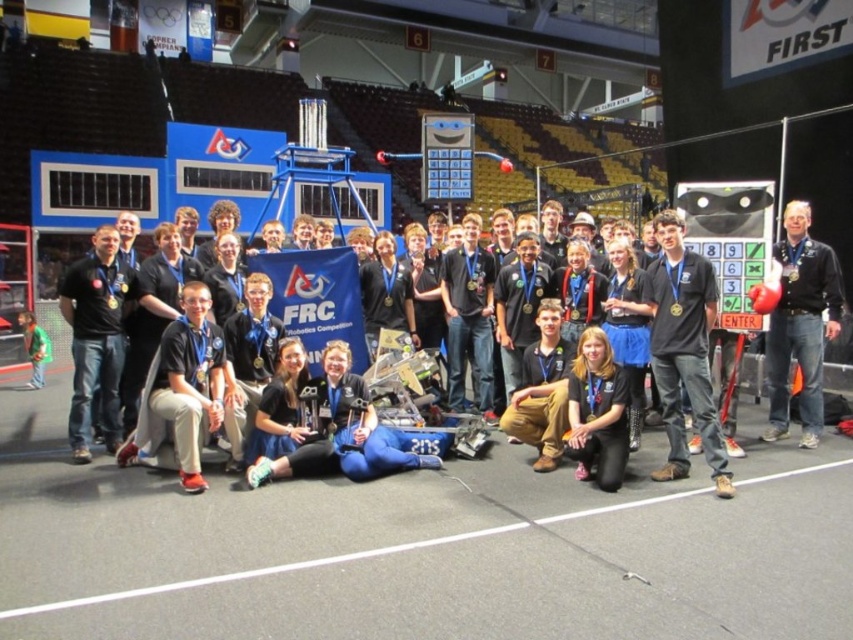
Question: Based on their relative distances, which object is farther from the matte black shirt at center?

Choices:
 (A) black cotton shirt at center
 (B) black fabric pants at lower center
 (C) black fabric shirt at center
 (D) black matte shirt at center

Answer: (D)

Question: Among these points, which one is nearest to the camera?

Choices:
 (A) (474, 332)
 (B) (293, 464)
 (C) (25, 337)

Answer: (B)

Question: Does black matte shirt at center have a greater width compared to black fabric shirt at center?

Choices:
 (A) yes
 (B) no

Answer: (A)

Question: Is black leather jacket at right thinner than green fabric shirt at lower left?

Choices:
 (A) yes
 (B) no

Answer: (A)

Question: Among these points, which one is nearest to the camera?

Choices:
 (A) (585, 355)
 (B) (779, 300)

Answer: (A)

Question: Does black matte shirt at center have a lesser width compared to black fabric pants at lower center?

Choices:
 (A) yes
 (B) no

Answer: (A)